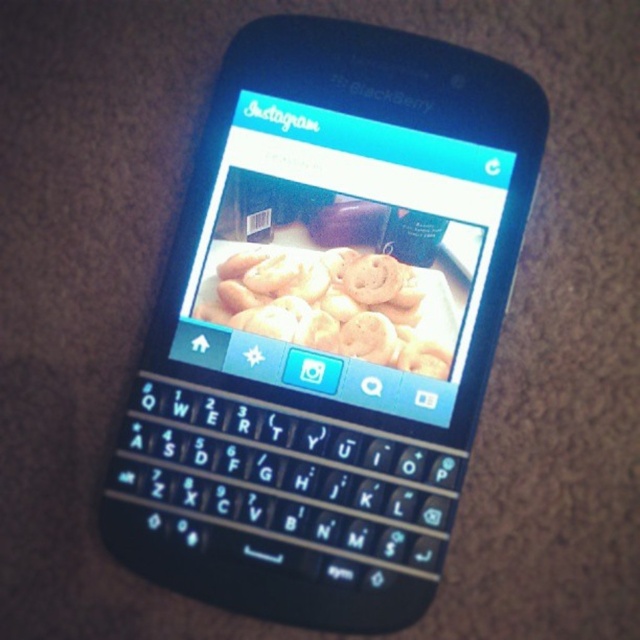
Identify the location of black plastic smartphone at center. (323, 324).

Between black plastic smartphone at center and matte plastic screen at center, which one appears on the left side from the viewer's perspective?

From the viewer's perspective, black plastic smartphone at center appears more on the left side.

At what (x,y) coordinates should I click in order to perform the action: click on black plastic smartphone at center. Please return your answer as a coordinate pair (x, y). Looking at the image, I should click on (323, 324).

Where is `black plastic smartphone at center`? This screenshot has height=640, width=640. black plastic smartphone at center is located at coordinates (323, 324).

Can you confirm if matte plastic screen at center is positioned to the left of golden matte cookies at center?

In fact, matte plastic screen at center is to the right of golden matte cookies at center.

Describe the element at coordinates (342, 257) in the screenshot. This screenshot has width=640, height=640. I see `matte plastic screen at center` at that location.

Does point (372, 323) come in front of point (390, 285)?

Yes.

Where is `matte plastic screen at center`? This screenshot has width=640, height=640. matte plastic screen at center is located at coordinates (342, 257).

Which is below, black plastic smartphone at center or golden matte cookies at center?

black plastic smartphone at center

Which is more to the left, black plastic smartphone at center or golden matte cookies at center?

Positioned to the left is black plastic smartphone at center.

The width and height of the screenshot is (640, 640). I want to click on black plastic smartphone at center, so click(x=323, y=324).